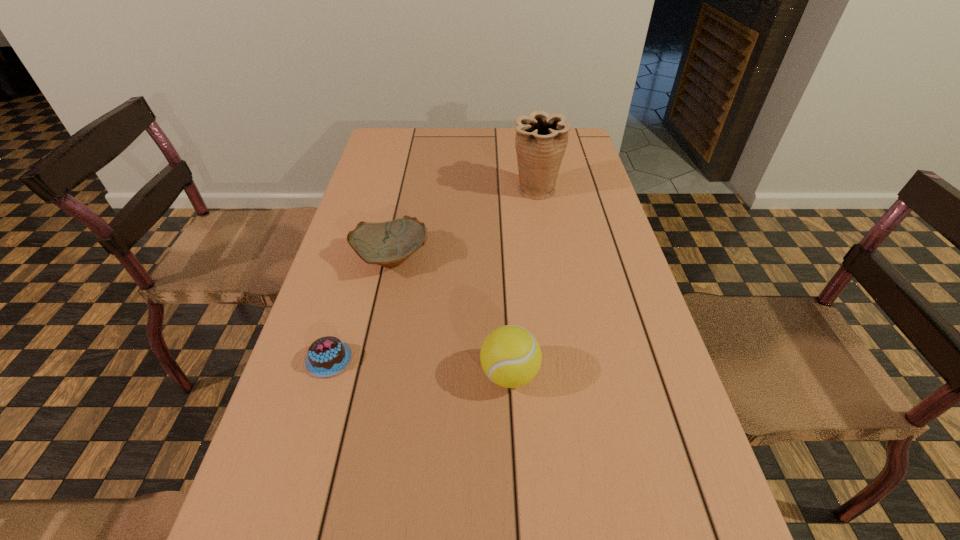
You are a GUI agent. You are given a task and a screenshot of the screen. Output one action in this format:
    pyautogui.click(x=<x>, y=<y>)
    Task: Click on the pottery at the left edge
    The width and height of the screenshot is (960, 540).
    Given the screenshot: What is the action you would take?
    pyautogui.click(x=389, y=244)

Image resolution: width=960 pixels, height=540 pixels. I want to click on chocolate cake that is at the left edge, so click(x=327, y=356).

Find the location of a particular element. The width and height of the screenshot is (960, 540). object at the right edge is located at coordinates click(541, 139).

In the image, there is a desktop. Where is `free space at the far edge`? This screenshot has width=960, height=540. free space at the far edge is located at coordinates (448, 149).

In the image, there is a desktop. Where is `free space at the left edge`? Image resolution: width=960 pixels, height=540 pixels. free space at the left edge is located at coordinates (278, 519).

Identify the location of free region at the right edge of the desktop. The image size is (960, 540). (617, 341).

Image resolution: width=960 pixels, height=540 pixels. I want to click on vacant space at the far left corner of the desktop, so click(x=408, y=138).

The image size is (960, 540). Find the location of `vacant region at the far right corner of the desktop`. vacant region at the far right corner of the desktop is located at coordinates (569, 133).

This screenshot has width=960, height=540. What are the coordinates of `free spot between the tennis ball and the shortest object` in the screenshot? It's located at (420, 367).

Locate an element on the screen. vacant space in between the chocolate cake and the farthest object is located at coordinates (432, 275).